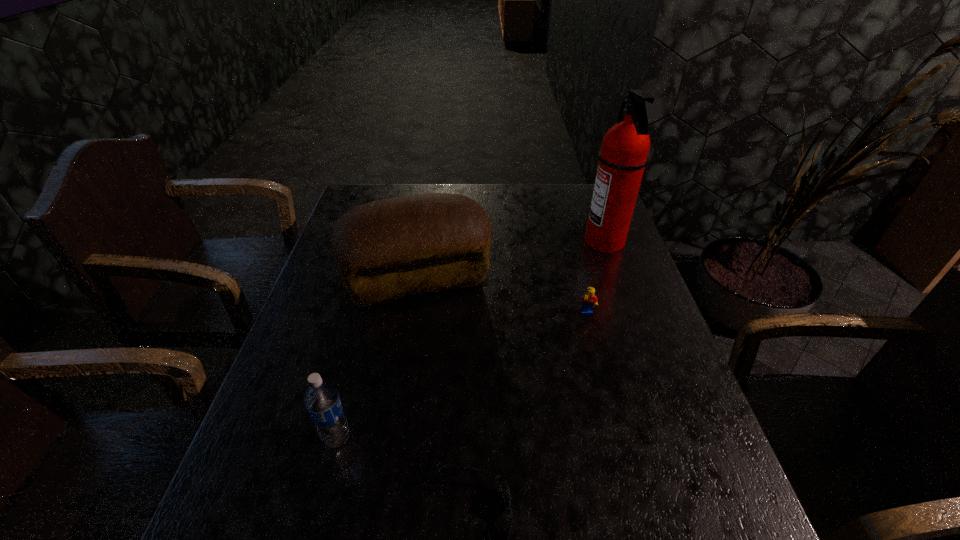
What are the coordinates of `vacant space at the far left corner` in the screenshot? It's located at (367, 197).

In the image, there is a desktop. At what (x,y) coordinates should I click in order to perform the action: click on vacant space at the far right corner. Please return your answer as a coordinate pair (x, y). Looking at the image, I should click on (586, 194).

In the image, there is a desktop. Where is `vacant region at the near right corner`? Image resolution: width=960 pixels, height=540 pixels. vacant region at the near right corner is located at coordinates (707, 533).

Locate an element on the screen. The image size is (960, 540). vacant area that lies between the tallest object and the bread is located at coordinates (512, 260).

Find the location of a particular element. free spot between the bread and the fourth tallest object is located at coordinates (503, 296).

The height and width of the screenshot is (540, 960). Find the location of `empty space that is in between the fourth shortest object and the third shortest object`. empty space that is in between the fourth shortest object and the third shortest object is located at coordinates (378, 358).

This screenshot has width=960, height=540. In order to click on free spot between the tallest object and the second nearest object in this screenshot , I will do `click(471, 340)`.

This screenshot has height=540, width=960. Find the location of `vacant area that lies between the fourth shortest object and the fourth object from left to right`. vacant area that lies between the fourth shortest object and the fourth object from left to right is located at coordinates (503, 296).

You are a GUI agent. You are given a task and a screenshot of the screen. Output one action in this format:
    pyautogui.click(x=<x>, y=<y>)
    Task: Click on the free space between the fourth shortest object and the water bottle
    The width and height of the screenshot is (960, 540).
    Given the screenshot: What is the action you would take?
    pyautogui.click(x=378, y=358)

Identify the location of the third closest object to the shortest object. The width and height of the screenshot is (960, 540). (589, 300).